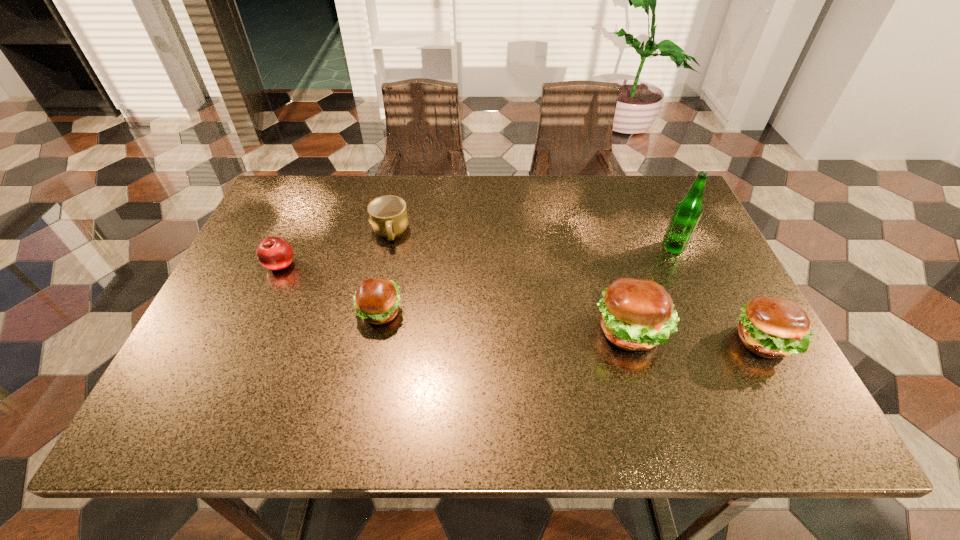
Where is `beer bottle at the right edge`? This screenshot has height=540, width=960. beer bottle at the right edge is located at coordinates (688, 211).

Locate an element on the screen. object that is at the near right corner is located at coordinates (770, 327).

At what (x,y) coordinates should I click in order to perform the action: click on free region at the far edge. Please return your answer as a coordinate pair (x, y). This screenshot has width=960, height=540. Looking at the image, I should click on (612, 185).

The height and width of the screenshot is (540, 960). I want to click on blank space at the near edge, so click(631, 384).

In the image, there is a desktop. Where is `vacant space at the left edge`? Image resolution: width=960 pixels, height=540 pixels. vacant space at the left edge is located at coordinates (311, 226).

The width and height of the screenshot is (960, 540). Find the location of `vacant space at the right edge`. vacant space at the right edge is located at coordinates (687, 341).

At what (x,y) coordinates should I click in order to perform the action: click on vacant area at the far right corner. Please return your answer as a coordinate pair (x, y). Looking at the image, I should click on click(x=673, y=191).

Locate an element on the screen. free space at the near right corner of the desktop is located at coordinates (752, 356).

What are the coordinates of `free space between the leftmost object and the mug` in the screenshot? It's located at (335, 249).

I want to click on free spot between the tallest hamburger and the mug, so click(511, 282).